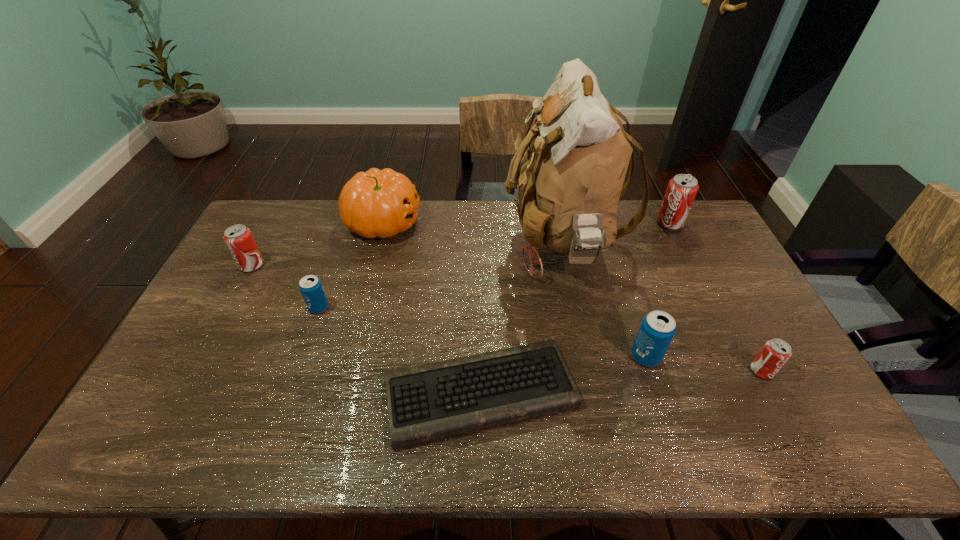
Identify the location of brown backpack. The height and width of the screenshot is (540, 960). (570, 181).

Where is `the tallest object`? This screenshot has width=960, height=540. the tallest object is located at coordinates (570, 181).

At what (x,y) coordinates should I click in order to perform the action: click on pumpkin. Please return your answer as a coordinate pair (x, y). Looking at the image, I should click on [378, 203].

Locate an element on the screen. This screenshot has height=540, width=960. the biggest pink soda can is located at coordinates (681, 191).

Find the location of a particular element. the tallest soda can is located at coordinates (681, 191).

This screenshot has height=540, width=960. In order to click on the fourth nearest soda can in this screenshot , I will do `click(238, 238)`.

Where is `the leftmost soda can`? Image resolution: width=960 pixels, height=540 pixels. the leftmost soda can is located at coordinates (238, 238).

Image resolution: width=960 pixels, height=540 pixels. I want to click on the right blue soda can, so click(658, 328).

Find the location of `the nearer blue soda can`. the nearer blue soda can is located at coordinates (658, 328).

Image resolution: width=960 pixels, height=540 pixels. I want to click on the smallest pink soda can, so click(x=775, y=353).